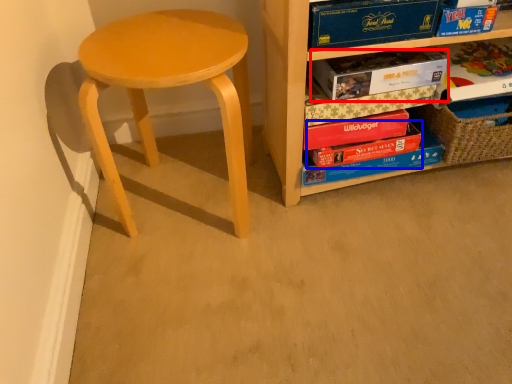
Question: Which object appears closest to the camera in this image, paperback book (highlighted by a red box) or paperback book (highlighted by a blue box)?

Choices:
 (A) paperback book
 (B) paperback book

Answer: (A)